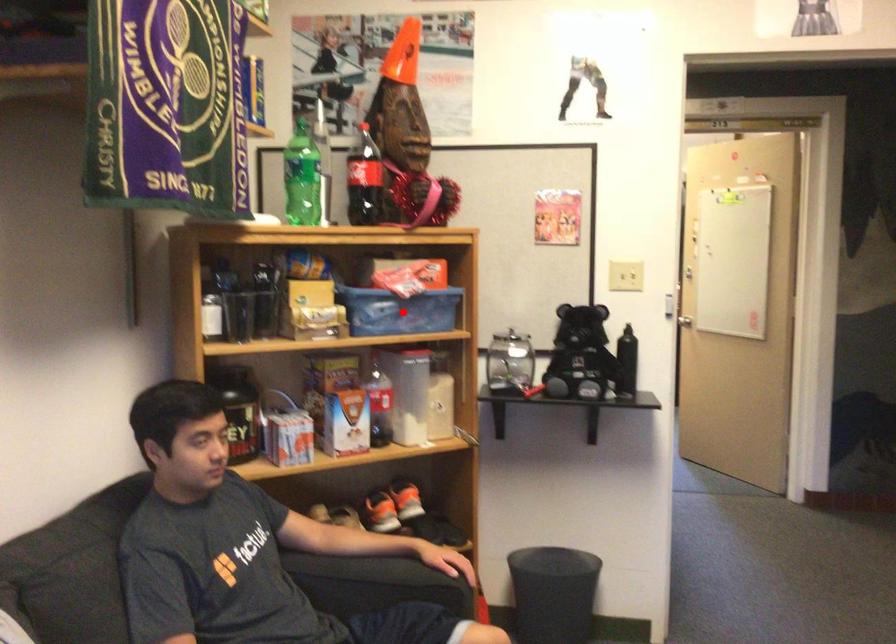
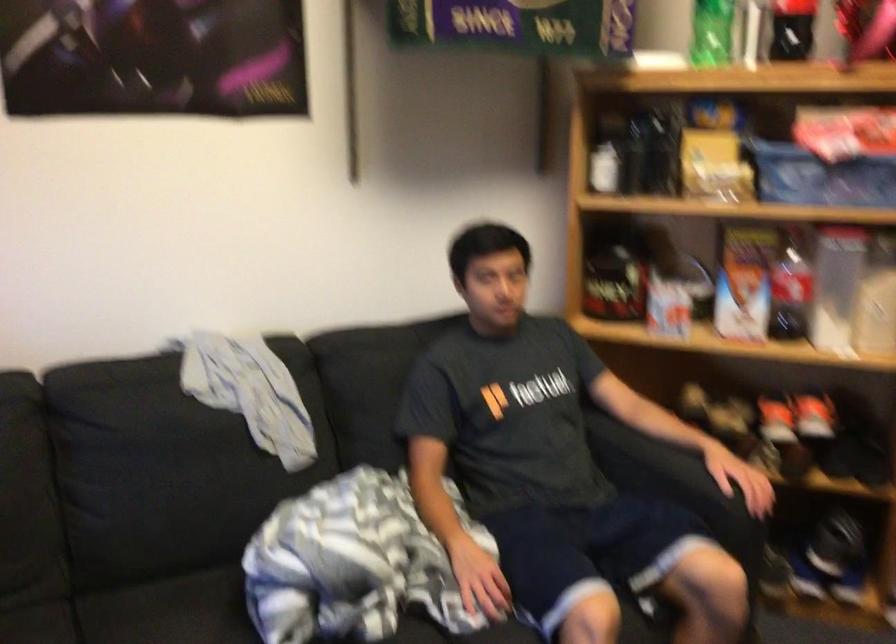
Question: I am providing you with two images of the same scene from different viewpoints. In image1, a red point is highlighted. Considering the same 3D point in image2, which of the following is correct?

Choices:
 (A) It is closer
 (B) It is farther

Answer: (A)